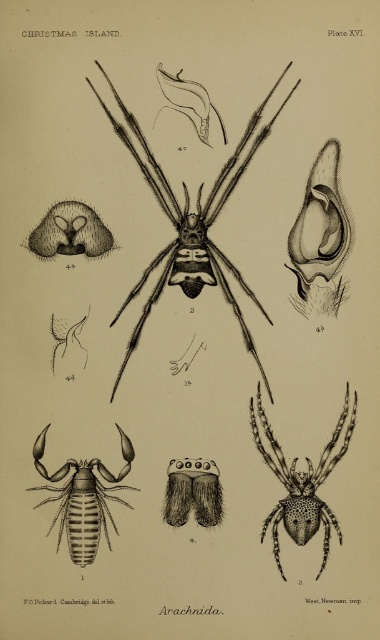
From the picture: Looking at the scientific illustration of the spider, which one is positioned to the right between the black ink spider at center and the black dotted spider at center?

The black dotted spider at center is positioned to the right of the black ink spider at center.

You are an entomologist examining this scientific illustration. You need to locate the brown striped scorpion at lower left for your research. Based on the illustration, is it positioned in front of or behind the black ink spider at center?

The brown striped scorpion at lower left is positioned behind the black ink spider at center, as stated in the object description.

Based on the illustration from Plate XVI of Arachnida, which spider, the black ink spider at center or the black dotted spider at center, has a greater height?

The black ink spider at center is taller than the black dotted spider at center according to the illustration.